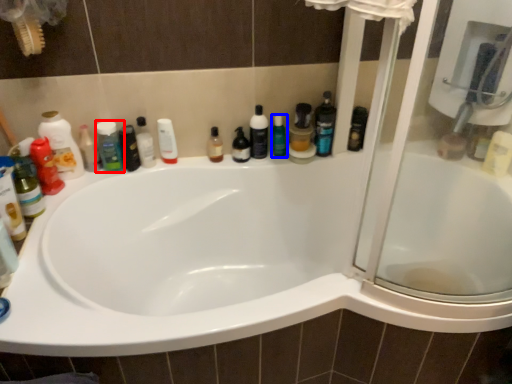
Question: Which point is further to the camera, toiletry (highlighted by a red box) or cleaning product (highlighted by a blue box)?

Choices:
 (A) toiletry
 (B) cleaning product

Answer: (B)